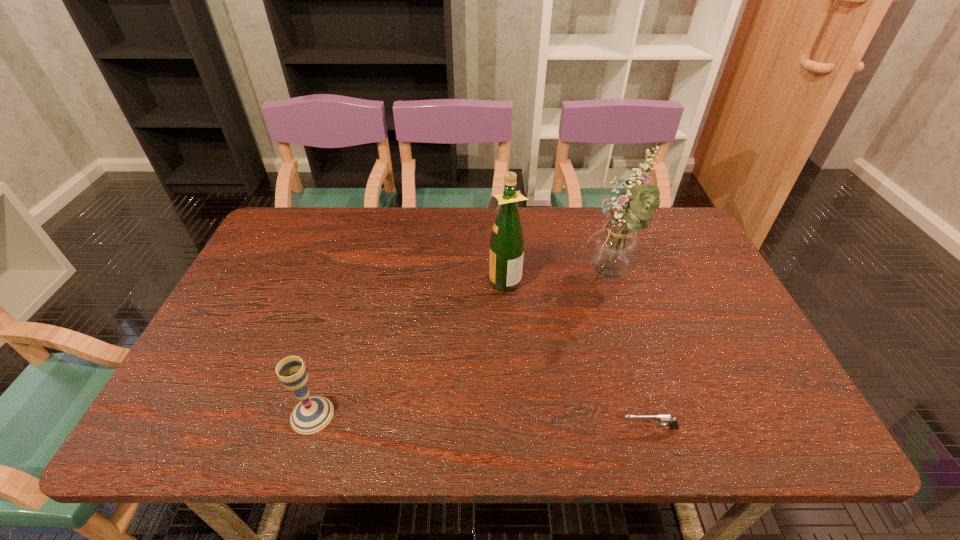
At what (x,y) coordinates should I click in order to perform the action: click on free space at the near edge of the desktop. Please return your answer as a coordinate pair (x, y). This screenshot has width=960, height=540. Looking at the image, I should click on (360, 435).

What are the coordinates of `vacant space at the left edge of the desktop` in the screenshot? It's located at (260, 283).

What are the coordinates of `free space at the right edge` in the screenshot? It's located at (711, 272).

Where is `free location at the far left corner`? Image resolution: width=960 pixels, height=540 pixels. free location at the far left corner is located at coordinates (305, 239).

Locate an element on the screen. The height and width of the screenshot is (540, 960). free space between the third object from right to left and the pistol is located at coordinates (576, 354).

Find the location of a particular element. The width and height of the screenshot is (960, 540). free spot between the bouquet and the leftmost object is located at coordinates (461, 347).

Locate an element on the screen. The image size is (960, 540). vacant area that lies between the chalice and the pistol is located at coordinates (481, 421).

Identify the location of free space between the pistol and the second shortest object. tap(481, 421).

The width and height of the screenshot is (960, 540). I want to click on free space between the pistol and the bouquet, so click(x=630, y=354).

Locate an element on the screen. free space between the shortest object and the bouquet is located at coordinates (630, 354).